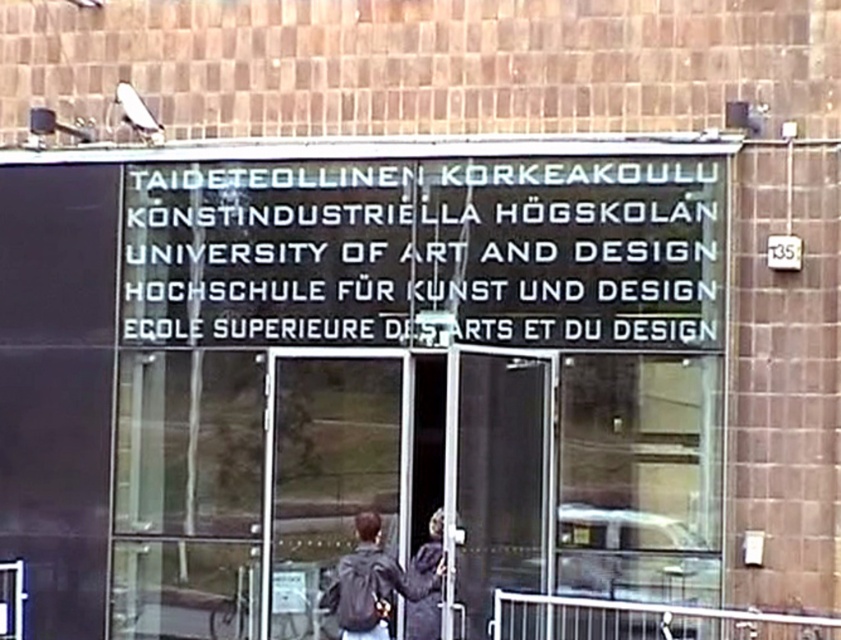
You are standing at the entrance of the building and see two points marked on the facade. The first point is at coordinate [173,300] and the second is at [415,611]. Which point is closer to you?

Point [173,300] is further to the camera than point [415,611], so the second point is closer to you.

You are standing at the entrance of the building and want to locate two specific points marked on the facade. The first point is at coordinate point(12, 244) and the second is at point(512, 298). Which point is closer to you?

Point(512, 298) is closer to you because it is in front of point(12, 244).

You are a student arriving at the entrance of the University of Art and Design. You see two jackets hanging on a rack at the center. The matte black jacket at center and the dark gray jacket at center. You want to hang your bag between them. Is there enough space for your 10 inch wide bag?

The matte black jacket at center is 12.52 inches from the dark gray jacket at center, so yes, there is enough space to hang your 10 inch wide bag between them since the distance between the jackets is greater than the bag width.